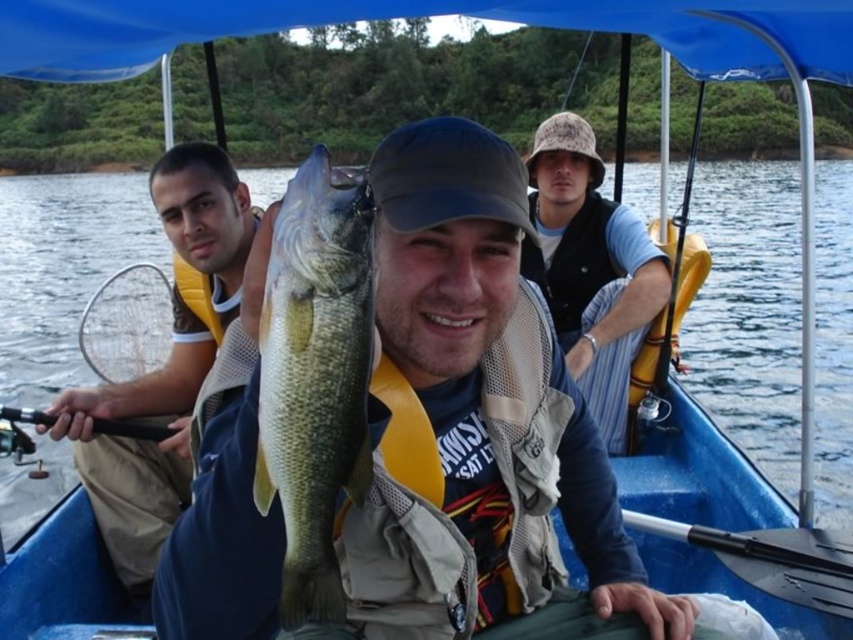
Question: Does yellow life vest at left appear under camouflage fabric bucket hat at upper right?

Choices:
 (A) no
 (B) yes

Answer: (B)

Question: Is the position of yellow life vest at left less distant than that of camouflage fabric bucket hat at upper right?

Choices:
 (A) no
 (B) yes

Answer: (B)

Question: Is green scaly fish at center positioned before yellow life vest at left?

Choices:
 (A) no
 (B) yes

Answer: (B)

Question: Which is farther from the camouflage fabric bucket hat at upper right?

Choices:
 (A) green scaly fish at center
 (B) yellow life vest at left

Answer: (A)

Question: Which point is closer to the camera?

Choices:
 (A) camouflage fabric bucket hat at upper right
 (B) yellow life vest at left
 (C) green scaly fish at center

Answer: (C)

Question: Which point is farther from the camera taking this photo?

Choices:
 (A) (67, 432)
 (B) (276, 296)

Answer: (A)